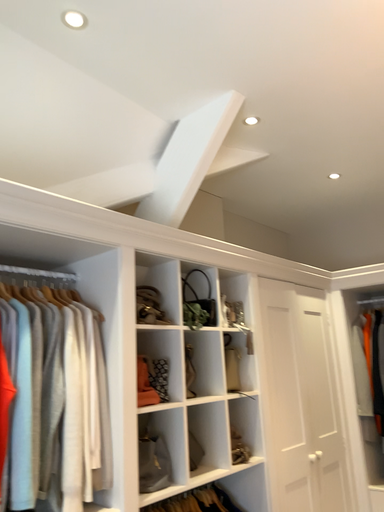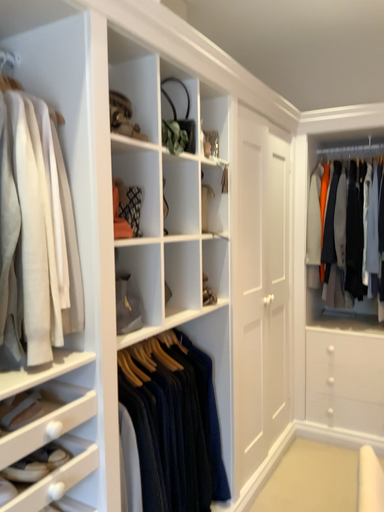
Question: How did the camera likely rotate when shooting the video?

Choices:
 (A) rotated downward
 (B) rotated upward

Answer: (A)